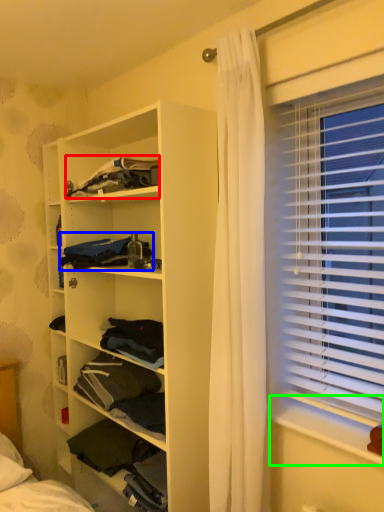
Question: Which object is positioned closest to clothing (highlighted by a red box)? Select from clothing (highlighted by a blue box) and window sill (highlighted by a green box).

Choices:
 (A) clothing
 (B) window sill

Answer: (A)